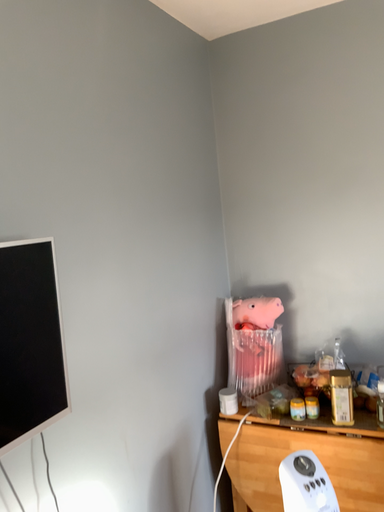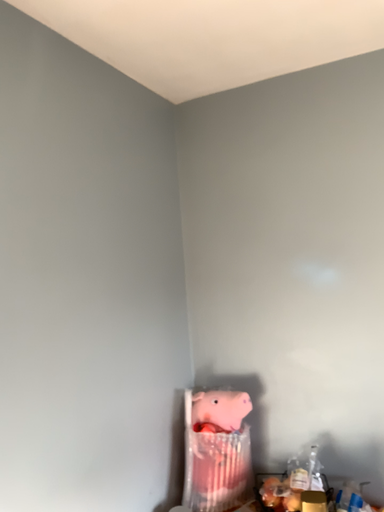
Question: Which way did the camera rotate in the video?

Choices:
 (A) rotated upward
 (B) rotated downward

Answer: (A)